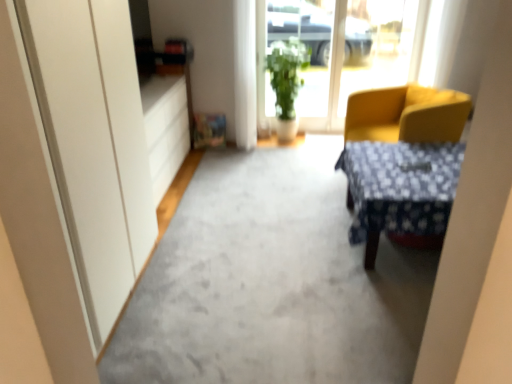
Question: Considering the relative sizes of green leafy plant at center and transparent glass window at center in the image provided, is green leafy plant at center smaller than transparent glass window at center?

Choices:
 (A) no
 (B) yes

Answer: (A)

Question: Can you confirm if green leafy plant at center is taller than transparent glass window at center?

Choices:
 (A) yes
 (B) no

Answer: (B)

Question: Is green leafy plant at center behind transparent glass window at center?

Choices:
 (A) no
 (B) yes

Answer: (A)

Question: Does green leafy plant at center have a larger size compared to transparent glass window at center?

Choices:
 (A) yes
 (B) no

Answer: (A)

Question: Could you tell me if green leafy plant at center is turned towards transparent glass window at center?

Choices:
 (A) yes
 (B) no

Answer: (B)

Question: Choose the correct answer: Is transparent glass window at center inside gray carpet at center or outside it?

Choices:
 (A) outside
 (B) inside

Answer: (A)

Question: From a real-world perspective, is transparent glass window at center positioned above or below gray carpet at center?

Choices:
 (A) above
 (B) below

Answer: (A)

Question: Is transparent glass window at center in front of or behind gray carpet at center in the image?

Choices:
 (A) behind
 (B) front

Answer: (A)

Question: Based on their positions, is transparent glass window at center located to the left or right of gray carpet at center?

Choices:
 (A) left
 (B) right

Answer: (B)

Question: In terms of width, does matte white drawer at left look wider or thinner when compared to green leafy plant at center?

Choices:
 (A) wide
 (B) thin

Answer: (B)

Question: Is matte white drawer at left inside or outside of green leafy plant at center?

Choices:
 (A) outside
 (B) inside

Answer: (A)

Question: Considering the positions of point (166, 79) and point (285, 54), is point (166, 79) closer or farther from the camera than point (285, 54)?

Choices:
 (A) closer
 (B) farther

Answer: (A)

Question: From the image's perspective, relative to green leafy plant at center, is matte white drawer at left above or below?

Choices:
 (A) above
 (B) below

Answer: (B)

Question: Considering the positions of matte white drawer at left and yellow fabric chair at right in the image, is matte white drawer at left taller or shorter than yellow fabric chair at right?

Choices:
 (A) tall
 (B) short

Answer: (A)

Question: Which is correct: matte white drawer at left is inside yellow fabric chair at right, or outside of it?

Choices:
 (A) outside
 (B) inside

Answer: (A)